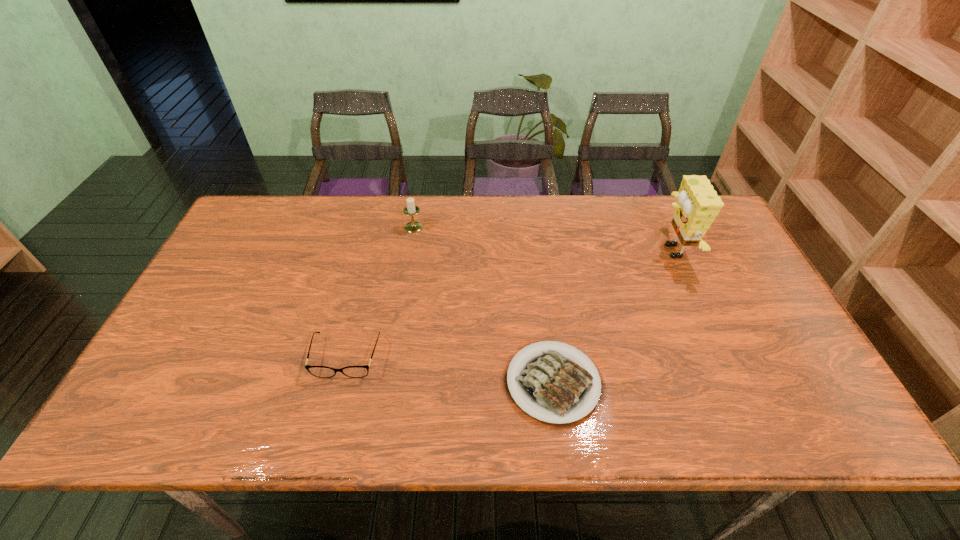
Where is `the rightmost object`? The width and height of the screenshot is (960, 540). the rightmost object is located at coordinates (697, 206).

In order to click on the tallest object in this screenshot , I will do `click(697, 206)`.

Where is `the second tallest object`? This screenshot has width=960, height=540. the second tallest object is located at coordinates (411, 209).

Identify the location of candle holder. (411, 209).

Image resolution: width=960 pixels, height=540 pixels. Identify the location of the leftmost object. (318, 371).

This screenshot has width=960, height=540. Find the location of `the third tallest object`. the third tallest object is located at coordinates (318, 371).

Locate an element on the screen. The image size is (960, 540). the third object from left to right is located at coordinates (553, 385).

Locate an element on the screen. the shortest object is located at coordinates (553, 385).

Locate an element on the screen. Image resolution: width=960 pixels, height=540 pixels. free space located 0.160m on the front-facing side of the sponge is located at coordinates (602, 251).

This screenshot has height=540, width=960. I want to click on free space located on the front-facing side of the sponge, so click(595, 251).